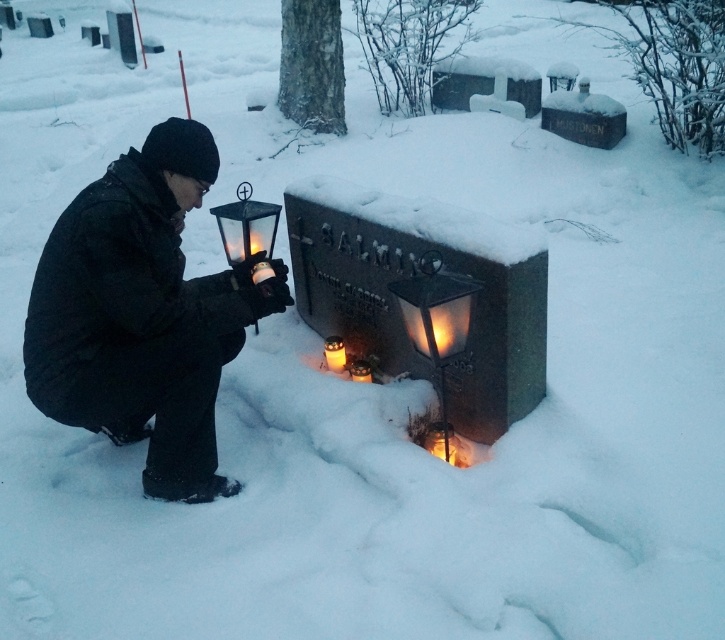
You are standing at the point with coordinates (141, 314) in the winter cemetery scene. Which object are you on?

You are on the black matte lantern at left.

You are standing in the snowy cemetery and see the black matte lantern at left and the matte glass lantern at center. Which lantern is closer to the grave marker?

The matte glass lantern at center is closer to the grave marker because the black matte lantern at left is to the left of it, placing the matte glass lantern at center nearer to the grave.

You are standing in a snowy cemetery and see the black matte lantern at left and the black glass lantern at center. Which lantern is located to the left of the other?

The black matte lantern at left is positioned on the left side of black glass lantern at center.